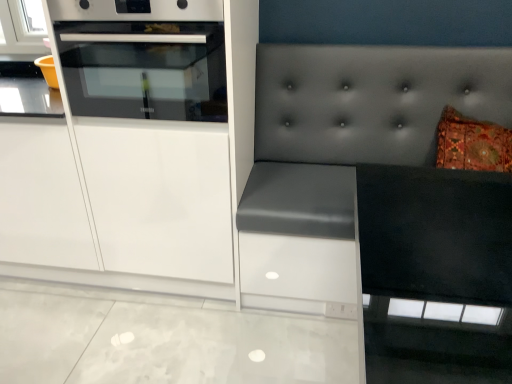
Question: Is white glossy oven at upper left outside of white glossy cabinet at left?

Choices:
 (A) no
 (B) yes

Answer: (A)

Question: Can you confirm if white glossy oven at upper left is positioned to the left of white glossy cabinet at left?

Choices:
 (A) yes
 (B) no

Answer: (A)

Question: From the image's perspective, is white glossy oven at upper left above white glossy cabinet at left?

Choices:
 (A) no
 (B) yes

Answer: (B)

Question: From the image's perspective, is white glossy oven at upper left below white glossy cabinet at left?

Choices:
 (A) no
 (B) yes

Answer: (A)

Question: Is white glossy oven at upper left not near white glossy cabinet at left?

Choices:
 (A) no
 (B) yes

Answer: (A)

Question: Can you confirm if white glossy oven at upper left is thinner than white glossy cabinet at left?

Choices:
 (A) yes
 (B) no

Answer: (B)

Question: Is white glossy cabinet at left facing towards matte gray cushion at right?

Choices:
 (A) no
 (B) yes

Answer: (A)

Question: Does white glossy cabinet at left have a lesser width compared to matte gray cushion at right?

Choices:
 (A) no
 (B) yes

Answer: (B)

Question: From the image's perspective, is white glossy cabinet at left located above matte gray cushion at right?

Choices:
 (A) yes
 (B) no

Answer: (A)

Question: Considering the relative sizes of white glossy cabinet at left and matte gray cushion at right in the image provided, is white glossy cabinet at left bigger than matte gray cushion at right?

Choices:
 (A) no
 (B) yes

Answer: (A)

Question: Is white glossy cabinet at left wider than matte gray cushion at right?

Choices:
 (A) yes
 (B) no

Answer: (B)

Question: Considering the relative positions of white glossy cabinet at left and matte gray cushion at right in the image provided, is white glossy cabinet at left behind matte gray cushion at right?

Choices:
 (A) no
 (B) yes

Answer: (B)

Question: Is white glossy cabinet at left at the left side of white glossy oven at upper left?

Choices:
 (A) no
 (B) yes

Answer: (A)